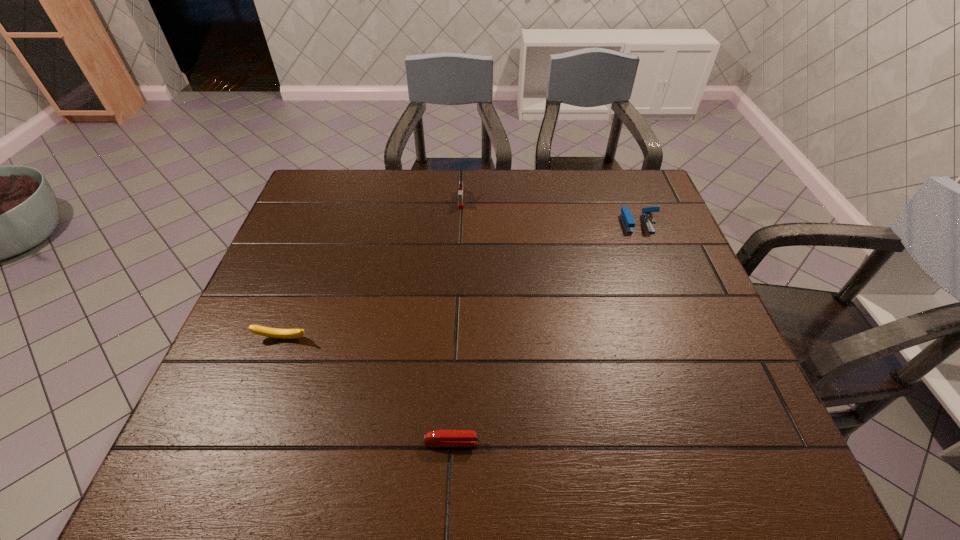
At what (x,y) coordinates should I click in order to perform the action: click on the farthest object. Please return your answer as a coordinate pair (x, y). Looking at the image, I should click on (460, 192).

Where is `the rightmost object`? the rightmost object is located at coordinates (626, 216).

Find the location of `the second nearest stapler`. the second nearest stapler is located at coordinates [x=626, y=216].

Where is `the leftmost object`? the leftmost object is located at coordinates click(x=256, y=329).

Where is `the third farthest object`? This screenshot has width=960, height=540. the third farthest object is located at coordinates (256, 329).

The width and height of the screenshot is (960, 540). What are the coordinates of `the nearest stapler` in the screenshot? It's located at point(438,437).

The image size is (960, 540). Identify the location of the shortest stapler. (438, 437).

Where is `vacant space situated 0.260m on the handle side of the farthest object`? This screenshot has height=540, width=960. vacant space situated 0.260m on the handle side of the farthest object is located at coordinates (458, 267).

In order to click on vacant region located 0.240m on the back of the rightmost stapler in this screenshot , I will do `click(616, 170)`.

Where is `vacant space located at the stem of the leftmost object`? The height and width of the screenshot is (540, 960). vacant space located at the stem of the leftmost object is located at coordinates (273, 366).